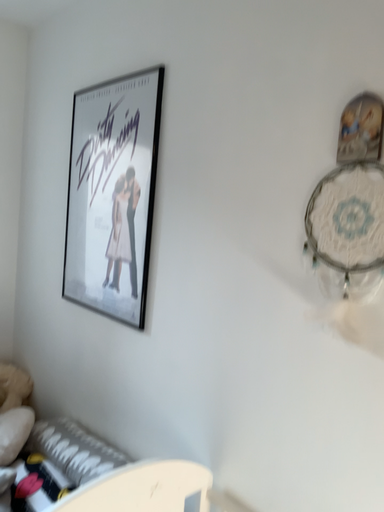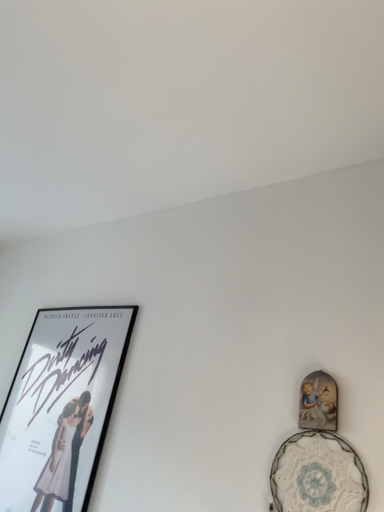
Question: How did the camera likely rotate when shooting the video?

Choices:
 (A) rotated right
 (B) rotated left

Answer: (A)